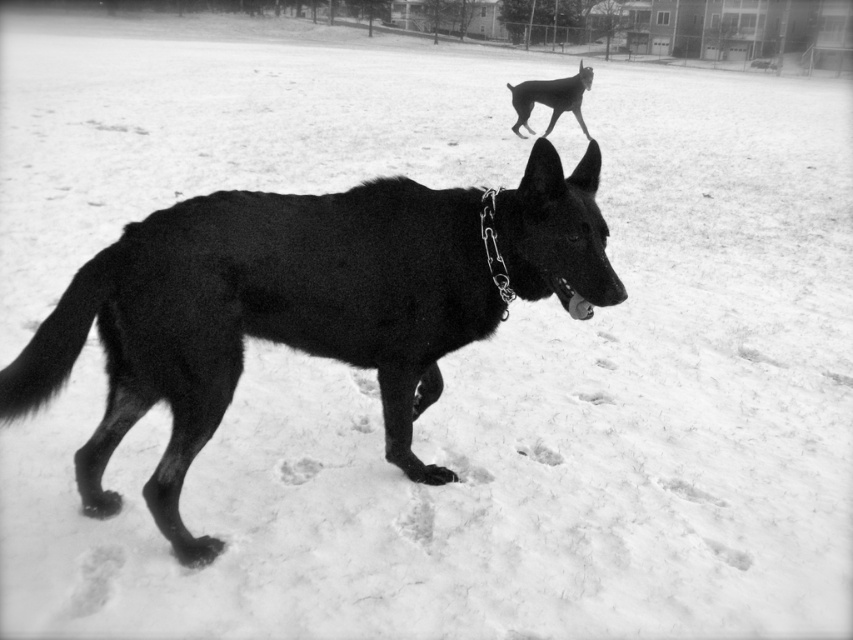
You are a photographer trying to capture both the shiny black dog at upper center and the metallic chain at center in a single frame. Based on their sizes in the image, which object would appear bigger in your photo?

The shiny black dog at upper center appears bigger in the photo because it has a larger size compared to the metallic chain at center.